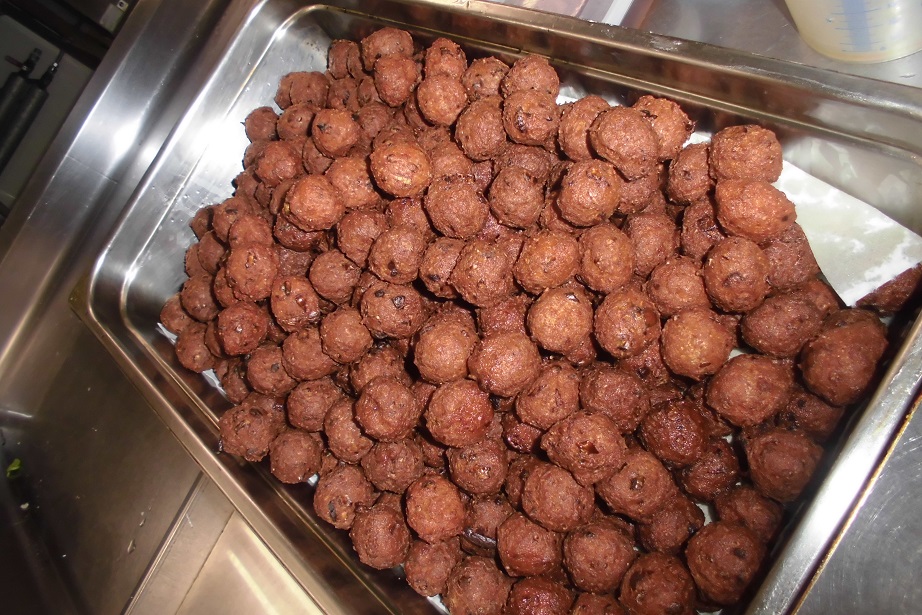
Where is `wall`? The height and width of the screenshot is (615, 922). wall is located at coordinates (85, 74).